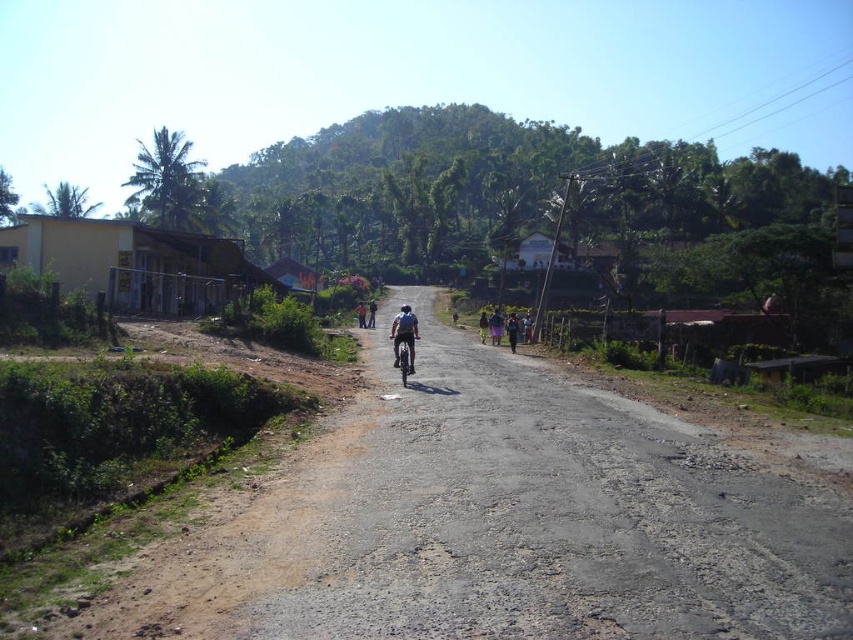
Is shiny metallic dirt bike at center positioned behind dark blue jeans at center?

No, shiny metallic dirt bike at center is closer to the viewer.

Which is behind, point (398, 339) or point (360, 314)?

The point (360, 314) is more distant.

This screenshot has width=853, height=640. What do you see at coordinates (403, 355) in the screenshot?
I see `shiny metallic dirt bike at center` at bounding box center [403, 355].

Locate an element on the screen. shiny metallic dirt bike at center is located at coordinates (403, 355).

Which is above, blue fabric pants at center or dark blue jeans at center?

Positioned higher is dark blue jeans at center.

Does blue fabric pants at center appear under dark blue jeans at center?

Yes.

The height and width of the screenshot is (640, 853). What are the coordinates of `blue fabric pants at center` in the screenshot? It's located at (495, 326).

What do you see at coordinates (137, 264) in the screenshot? I see `yellow matte building at left` at bounding box center [137, 264].

Who is higher up, yellow matte building at left or blue fabric dress at center?

Positioned higher is yellow matte building at left.

Image resolution: width=853 pixels, height=640 pixels. Find the location of `yellow matte building at left`. yellow matte building at left is located at coordinates (137, 264).

What are the coordinates of `yellow matte building at left` in the screenshot? It's located at (137, 264).